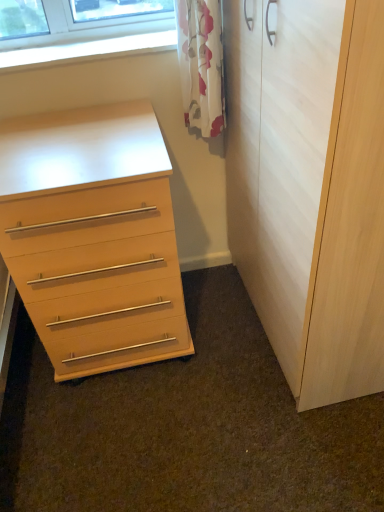
Image resolution: width=384 pixels, height=512 pixels. I want to click on unoccupied region to the right of light wood/finish chest of drawers at left, so click(x=218, y=331).